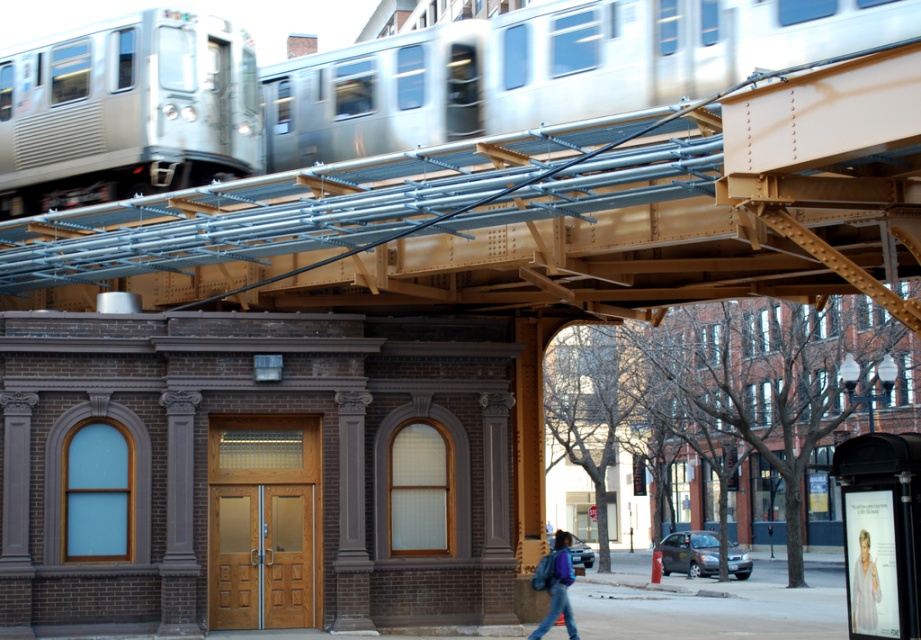
Locate an element on the screen. silver metallic train at upper center is located at coordinates (549, 68).

The height and width of the screenshot is (640, 921). Describe the element at coordinates (549, 68) in the screenshot. I see `silver metallic train at upper center` at that location.

Measure the distance between point (787, 32) and camera.

A distance of 17.47 meters exists between point (787, 32) and camera.

I want to click on silver metallic train at upper center, so click(549, 68).

Identify the location of silver metallic train at upper left. (126, 109).

Is point (157, 32) farther from camera compared to point (554, 560)?

Yes.

Is point (140, 28) in front of point (575, 628)?

No, it is behind (575, 628).

You are a GUI agent. You are given a task and a screenshot of the screen. Output one action in this format:
    pyautogui.click(x=<x>, y=<y>)
    Task: Click on the silver metallic train at upper left
    
    Given the screenshot: What is the action you would take?
    pyautogui.click(x=126, y=109)

Is silver metallic train at upper center positioned before silver metallic train at upper left?

Yes, silver metallic train at upper center is closer to the viewer.

Identify the location of silver metallic train at upper center. point(549,68).